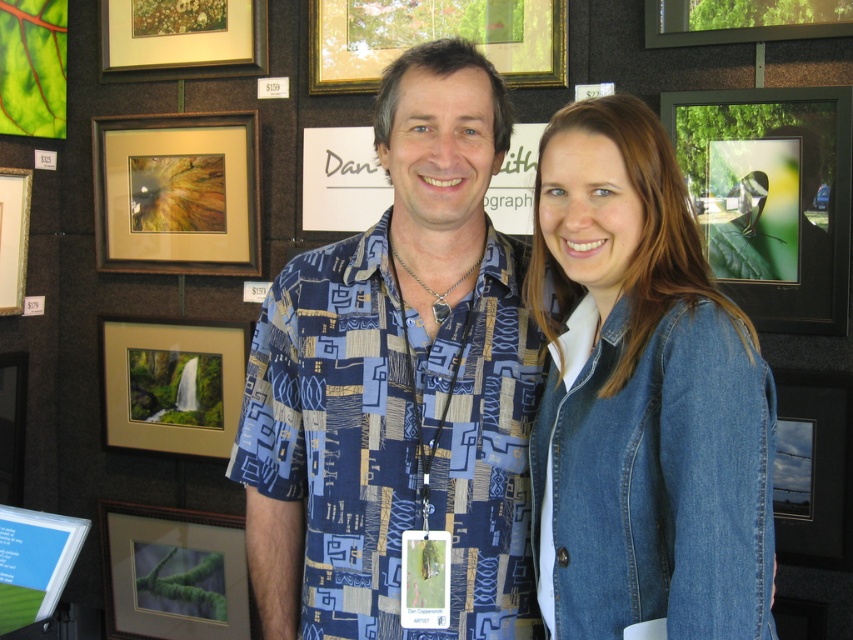
Question: Which object is closer to the camera taking this photo?

Choices:
 (A) gold-framed picture at upper center
 (B) blue printed shirt at center

Answer: (B)

Question: Does wooden frame at upper left appear on the left side of metallic silver frame at lower right?

Choices:
 (A) yes
 (B) no

Answer: (A)

Question: Can you confirm if blue printed shirt at center is thinner than denim jacket at lower right?

Choices:
 (A) yes
 (B) no

Answer: (B)

Question: Which point is farther to the camera?

Choices:
 (A) metallic silver frame at lower right
 (B) matte black frame at upper right
 (C) metallic silver frame at upper right

Answer: (C)

Question: Among these objects, which one is nearest to the camera?

Choices:
 (A) blue printed shirt at center
 (B) gold matte picture frame at center
 (C) wooden frame at upper left

Answer: (A)

Question: Considering the relative positions of matte black frame at upper right and gold matte picture frame at center in the image provided, where is matte black frame at upper right located with respect to gold matte picture frame at center?

Choices:
 (A) below
 (B) above

Answer: (B)